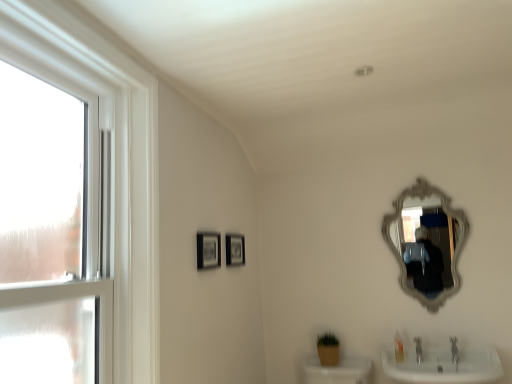
Question: Can you confirm if translucent plastic soap at lower right is shorter than clear glass window at left?

Choices:
 (A) yes
 (B) no

Answer: (A)

Question: Is translucent plastic soap at lower right positioned with its back to clear glass window at left?

Choices:
 (A) no
 (B) yes

Answer: (A)

Question: Can you confirm if translucent plastic soap at lower right is wider than clear glass window at left?

Choices:
 (A) yes
 (B) no

Answer: (B)

Question: Would you consider translucent plastic soap at lower right to be distant from clear glass window at left?

Choices:
 (A) yes
 (B) no

Answer: (A)

Question: Is translucent plastic soap at lower right outside of clear glass window at left?

Choices:
 (A) no
 (B) yes

Answer: (B)

Question: Can you confirm if translucent plastic soap at lower right is bigger than clear glass window at left?

Choices:
 (A) no
 (B) yes

Answer: (A)

Question: Does matte black picture frame at center, placed as the 2th picture frame when sorted from back to front, have a larger size compared to translucent plastic soap at lower right?

Choices:
 (A) no
 (B) yes

Answer: (B)

Question: Is matte black picture frame at center, placed as the 2th picture frame when sorted from back to front, wider than translucent plastic soap at lower right?

Choices:
 (A) yes
 (B) no

Answer: (B)

Question: Considering the relative sizes of matte black picture frame at center, which ranks as the 2th picture frame in right-to-left order, and translucent plastic soap at lower right in the image provided, is matte black picture frame at center, which ranks as the 2th picture frame in right-to-left order, smaller than translucent plastic soap at lower right?

Choices:
 (A) yes
 (B) no

Answer: (B)

Question: Is matte black picture frame at center, the first picture frame viewed from the front, further to camera compared to translucent plastic soap at lower right?

Choices:
 (A) no
 (B) yes

Answer: (A)

Question: From the image's perspective, would you say matte black picture frame at center, the first picture frame viewed from the front, is positioned over translucent plastic soap at lower right?

Choices:
 (A) no
 (B) yes

Answer: (B)

Question: Considering the relative positions of matte black picture frame at center, which ranks as the first picture frame in left-to-right order, and translucent plastic soap at lower right in the image provided, is matte black picture frame at center, which ranks as the first picture frame in left-to-right order, to the right of translucent plastic soap at lower right from the viewer's perspective?

Choices:
 (A) no
 (B) yes

Answer: (A)

Question: Is clear glass window at left wider than matte black picture frame at center, the 2th picture frame viewed from the left?

Choices:
 (A) no
 (B) yes

Answer: (B)